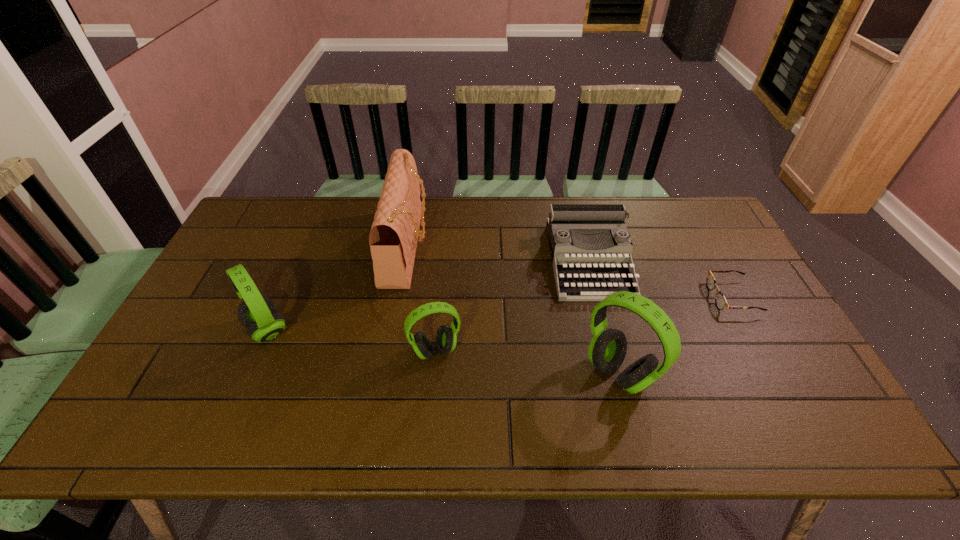
I want to click on vacant area that satisfies the following two spatial constraints: 1. on the frame of the shortest object; 2. on the front side of the second headset from right to left, so click(x=761, y=351).